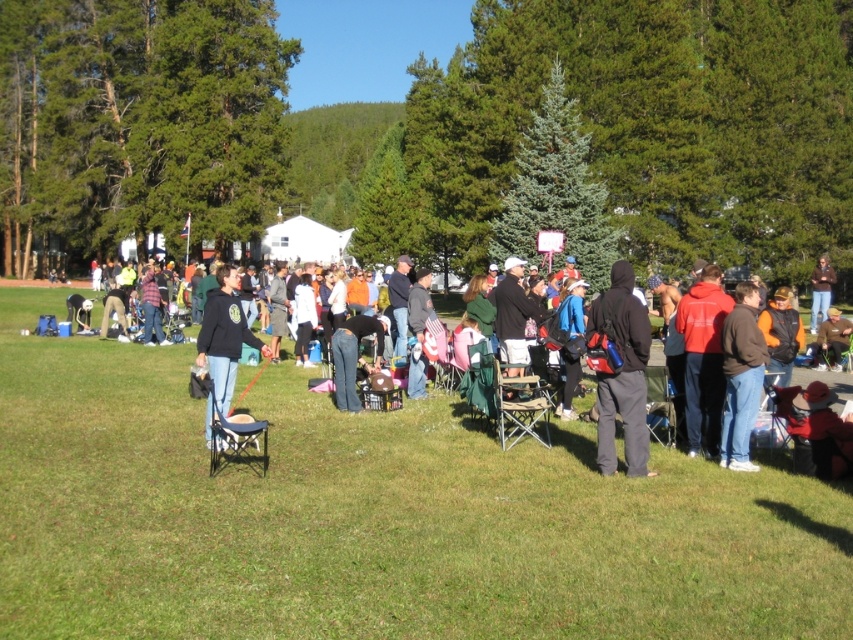
Question: Which point appears farthest from the camera in this image?

Choices:
 (A) (814, 326)
 (B) (363, 316)
 (C) (369, 636)

Answer: (A)

Question: Is jeans at center thinner than brown leather jacket at center?

Choices:
 (A) yes
 (B) no

Answer: (A)

Question: Can you confirm if black fleece jacket at center is positioned above jeans at center?

Choices:
 (A) yes
 (B) no

Answer: (A)

Question: Which of the following is the farthest from the observer?

Choices:
 (A) jeans at center
 (B) red hoodie at right

Answer: (A)

Question: Estimate the real-world distances between objects in this image. Which object is closer to the red hoodie at right?

Choices:
 (A) brown cotton jacket at right
 (B) black fabric chair at lower left
 (C) brown leather jacket at center
 (D) matte black hoodie at center

Answer: (A)

Question: Is matte black hoodie at center bigger than black fleece jacket at center?

Choices:
 (A) no
 (B) yes

Answer: (B)